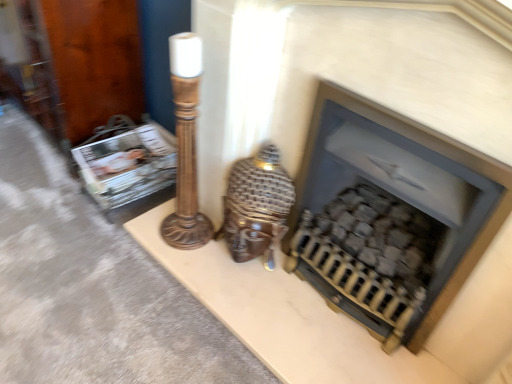
In order to click on free spot in front of matte plastic magazine at left in this screenshot , I will do `click(98, 235)`.